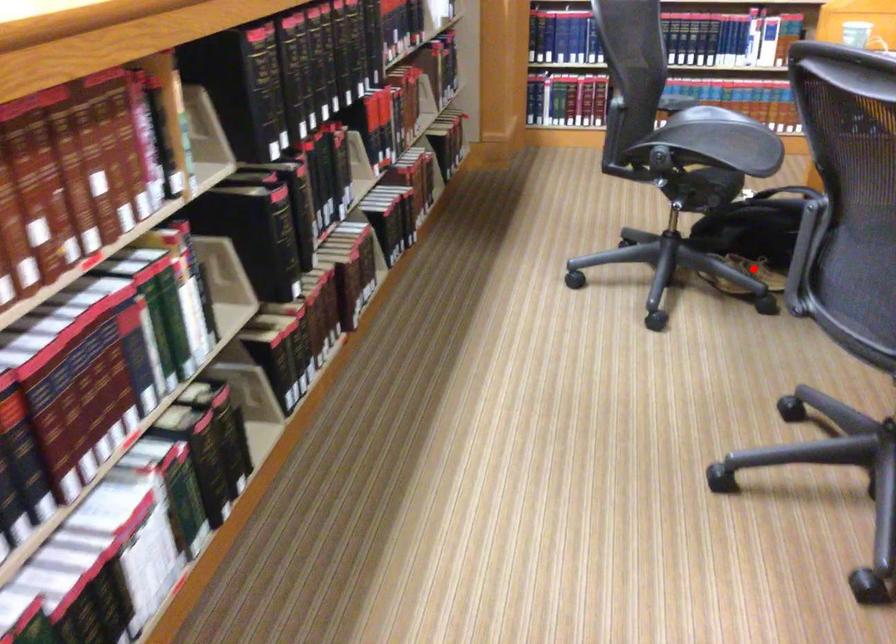
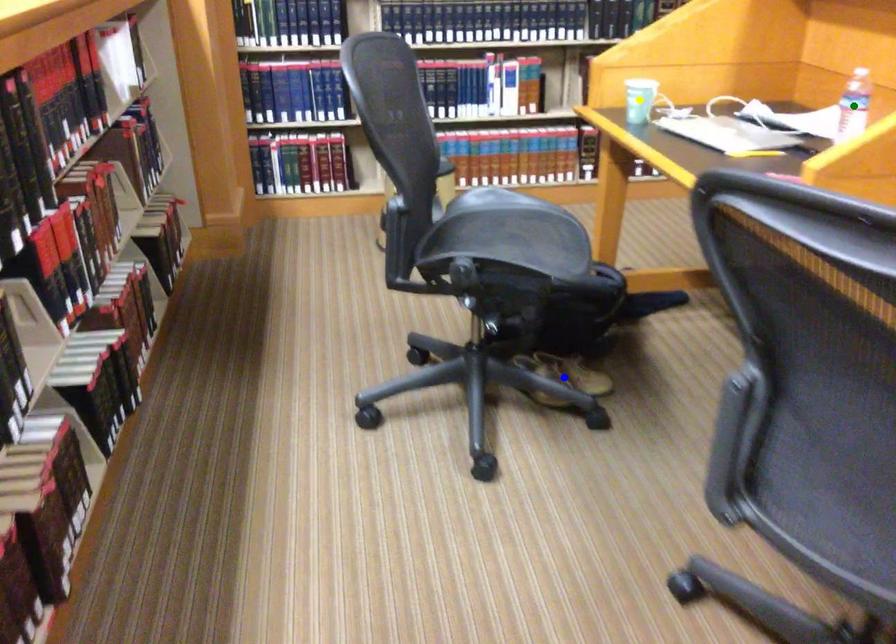
Question: I am providing you with two images of the same scene from different viewpoints. A red point is marked on the first image. You are given multiple points on the second image. Which point in image 2 is actually the same real-world point as the red point in image 1?

Choices:
 (A) green point
 (B) yellow point
 (C) blue point

Answer: (C)